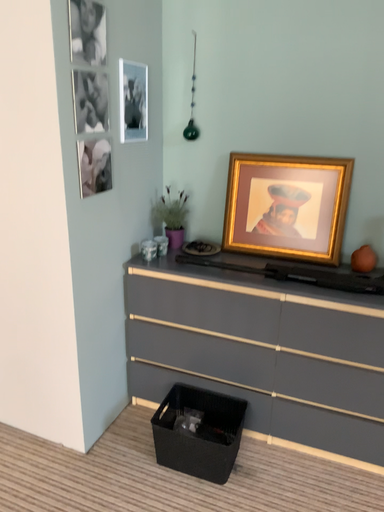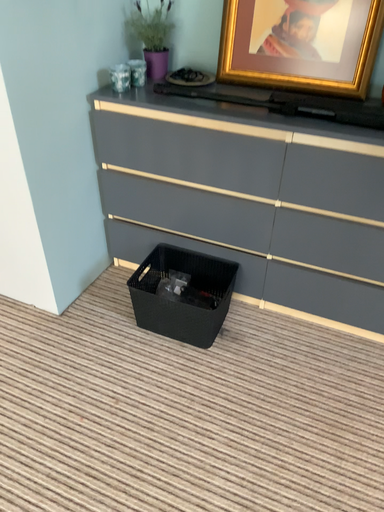
Question: Which way did the camera rotate in the video?

Choices:
 (A) rotated downward
 (B) rotated upward

Answer: (A)